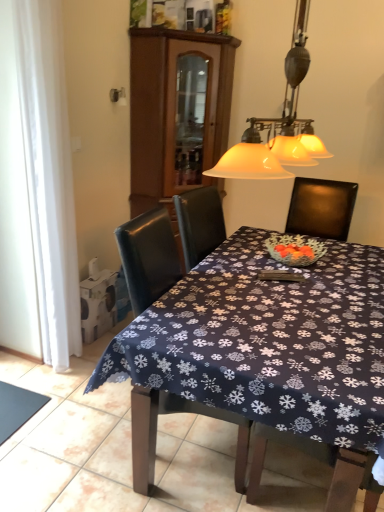
Identify the location of vacant region to the left of white sheer curtain at left. (26, 365).